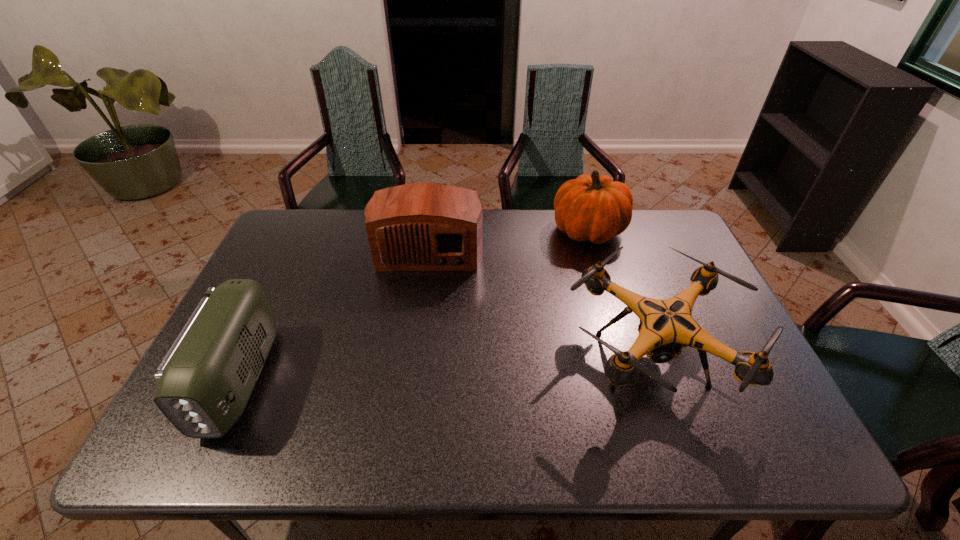
Locate an element on the screen. The width and height of the screenshot is (960, 540). pumpkin is located at coordinates [594, 208].

I want to click on the farther radio_receiver, so click(425, 226).

In order to click on the right radio_receiver in this screenshot , I will do `click(425, 226)`.

Find the location of a particular element. This screenshot has width=960, height=540. drone is located at coordinates (666, 326).

What are the coordinates of `the nearer radio_receiver` in the screenshot? It's located at (204, 382).

Find the location of a particular element. the left radio_receiver is located at coordinates tap(204, 382).

You are a GUI agent. You are given a task and a screenshot of the screen. Output one action in this format:
    pyautogui.click(x=<x>, y=<y>)
    Task: Click on the free spot located on the left of the pumpkin
    The width and height of the screenshot is (960, 540).
    Given the screenshot: What is the action you would take?
    pyautogui.click(x=507, y=230)

This screenshot has width=960, height=540. Identify the location of vacant space located 0.230m on the front-facing side of the farther radio_receiver. (418, 336).

I want to click on pumpkin that is positioned at the far edge, so click(x=594, y=208).

You are a GUI agent. You are given a task and a screenshot of the screen. Output one action in this format:
    pyautogui.click(x=<x>, y=<y>)
    Task: Click on the radio receiver that is positioned at the far edge
    
    Given the screenshot: What is the action you would take?
    pyautogui.click(x=425, y=226)